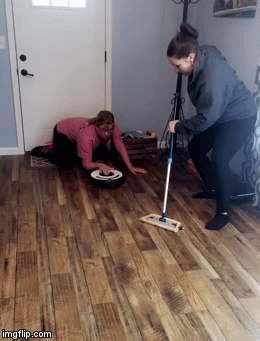
The height and width of the screenshot is (341, 260). In order to click on roomba in this screenshot , I will do `click(106, 178)`.